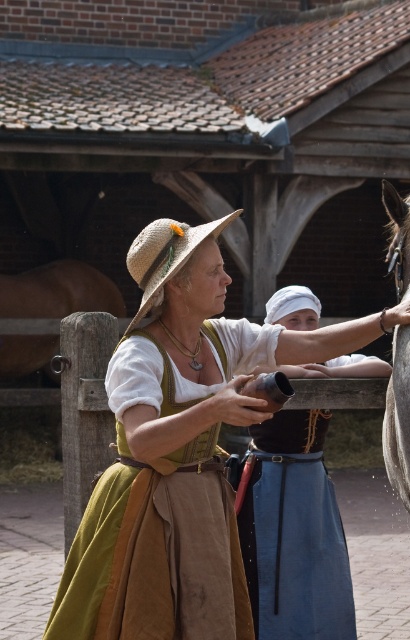
Between matte brown leather purse at center and brown leather horse at right, which one appears on the left side from the viewer's perspective?

From the viewer's perspective, matte brown leather purse at center appears more on the left side.

Is matte brown leather purse at center below brown leather horse at right?

Indeed, matte brown leather purse at center is positioned under brown leather horse at right.

Is point (241, 474) in front of point (400, 422)?

No, (241, 474) is behind (400, 422).

The height and width of the screenshot is (640, 410). In order to click on matte brown leather purse at center in this screenshot , I will do `click(293, 531)`.

Is brown leather horse at right wider than straw hat at center?

In fact, brown leather horse at right might be narrower than straw hat at center.

Is point (398, 428) less distant than point (143, 253)?

No, (398, 428) is behind (143, 253).

Who is more forward, (384, 198) or (168, 220)?

Point (384, 198) is more forward.

Find the location of a particular element. This screenshot has height=640, width=410. brown leather horse at right is located at coordinates (398, 417).

Does matte brown leather purse at center have a smaller size compared to straw hat at center?

No.

Is matte brown leather purse at center above straw hat at center?

Incorrect, matte brown leather purse at center is not positioned above straw hat at center.

In order to click on matte brown leather purse at center in this screenshot , I will do pyautogui.click(x=293, y=531).